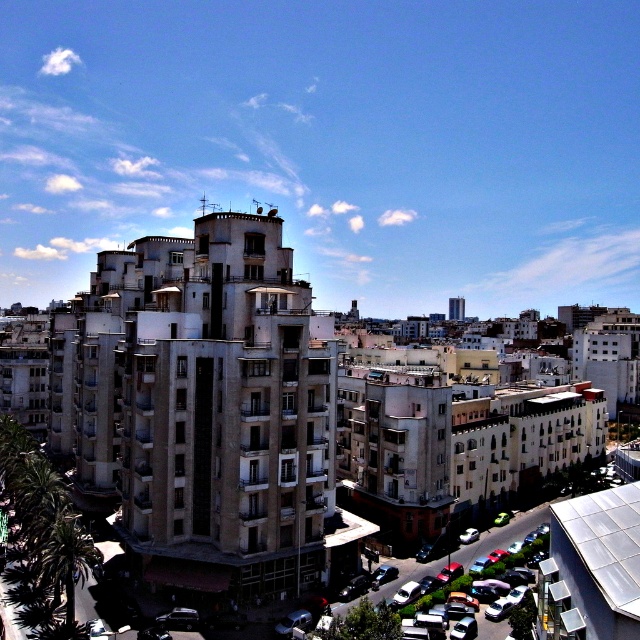
Question: Which point is closer to the camera taking this photo?

Choices:
 (A) (451, 588)
 (B) (166, 612)
 (C) (465, 536)

Answer: (B)

Question: Is shiny black car at center behind white glossy car at center?

Choices:
 (A) no
 (B) yes

Answer: (A)

Question: Among these objects, which one is farthest from the camera?

Choices:
 (A) shiny silver car at lower right
 (B) shiny black car at center
 (C) white glossy car at center

Answer: (C)

Question: Is shiny silver car at lower right thinner than white glossy car at center?

Choices:
 (A) no
 (B) yes

Answer: (A)

Question: Among these points, which one is farthest from the camera?

Choices:
 (A) tap(474, 540)
 (B) tap(173, 620)

Answer: (A)

Question: Is shiny silver car at lower right smaller than shiny black car at center?

Choices:
 (A) no
 (B) yes

Answer: (A)